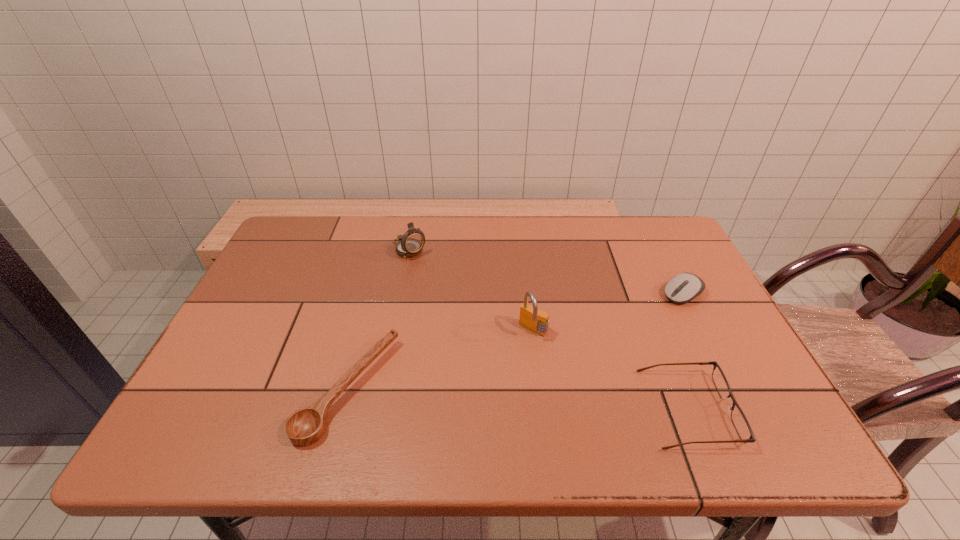
I want to click on computer equipment that is at the right edge, so click(x=683, y=288).

Identify the location of object that is positioned at the near right corner. Image resolution: width=960 pixels, height=540 pixels. (740, 422).

Where is `vacant space at the far edge`? This screenshot has width=960, height=540. vacant space at the far edge is located at coordinates [557, 221].

The width and height of the screenshot is (960, 540). I want to click on vacant space at the near edge of the desktop, so click(277, 381).

Find the location of a particular element. blank area at the left edge is located at coordinates (269, 269).

What are the coordinates of `vacant position at the right edge of the desktop` in the screenshot? It's located at (648, 262).

This screenshot has width=960, height=540. What are the coordinates of `vacant space at the far left corner` in the screenshot? It's located at (322, 243).

Locate an element on the screen. The height and width of the screenshot is (540, 960). vacant space at the far right corner of the desktop is located at coordinates (641, 221).

You are a GUI agent. You are given a task and a screenshot of the screen. Output one action in this format:
    pyautogui.click(x=<x>, y=<y>)
    Task: Click on the vacant point located between the wooden spoon and the second farthest object
    The height and width of the screenshot is (540, 960).
    Given the screenshot: What is the action you would take?
    pyautogui.click(x=516, y=341)

This screenshot has width=960, height=540. Identify the location of blank region between the compass and the second farthest object. (546, 272).